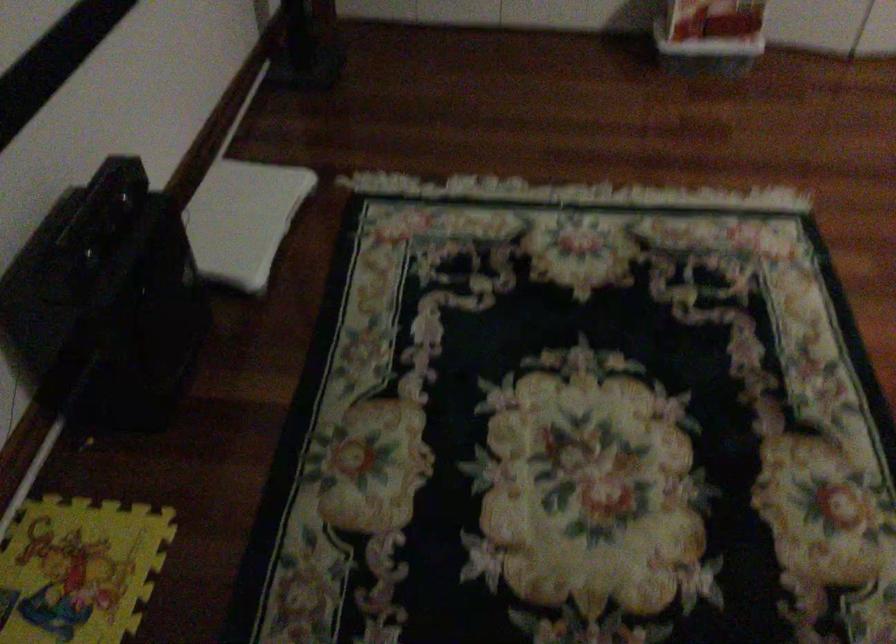
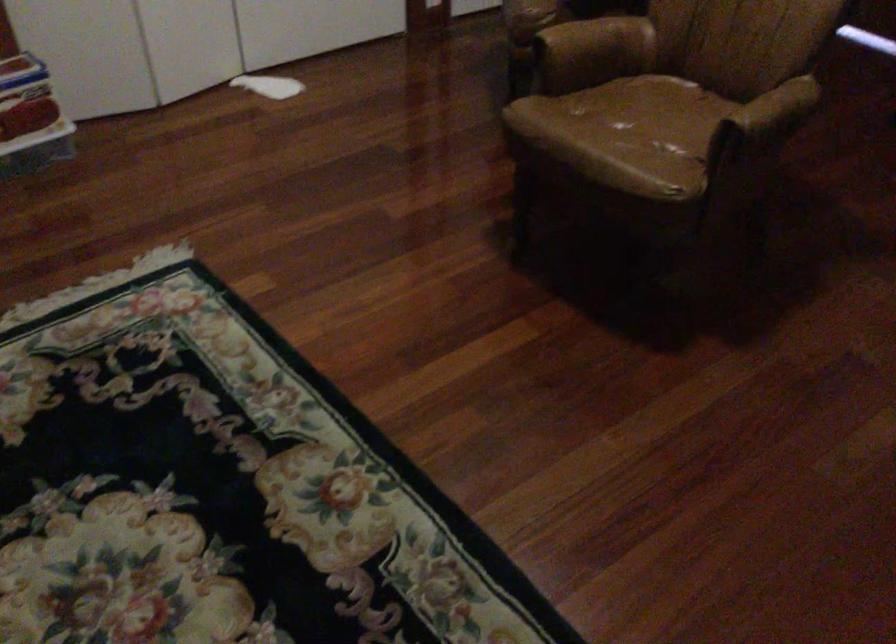
Question: Based on the continuous images, in which direction is the camera rotating? Reply with the corresponding letter.

Choices:
 (A) Left
 (B) Right
 (C) Up
 (D) Down

Answer: (B)